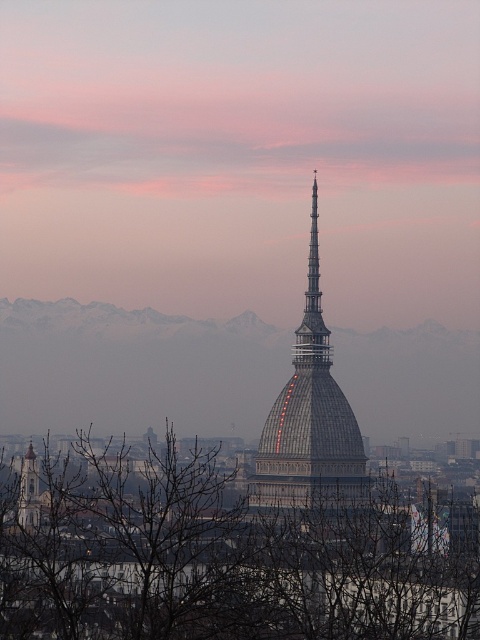
Question: Can you confirm if bare branches at center is positioned above brick tower at left?

Choices:
 (A) no
 (B) yes

Answer: (A)

Question: Which object appears closest to the camera in this image?

Choices:
 (A) metallic dome at center
 (B) brick tower at left
 (C) gray stone tower at center

Answer: (C)

Question: Is bare branches at center thinner than brick tower at left?

Choices:
 (A) no
 (B) yes

Answer: (A)

Question: Which point appears farthest from the camera in this image?

Choices:
 (A) (21, 513)
 (B) (472, 404)

Answer: (B)

Question: Does bare branches at center have a larger size compared to brick tower at left?

Choices:
 (A) no
 (B) yes

Answer: (B)

Question: Estimate the real-world distances between objects in this image. Which object is farther from the metallic dome at center?

Choices:
 (A) bare branches at center
 (B) brick tower at left

Answer: (B)